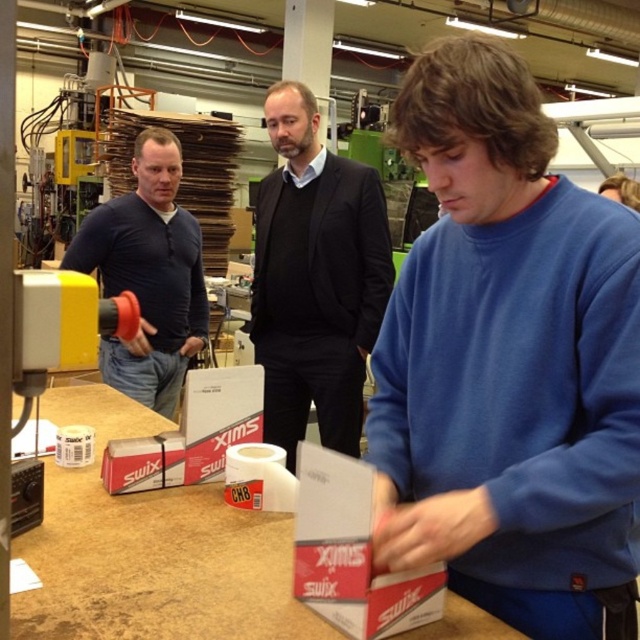
In the workshop scene, there are two people wearing the blue cotton sweatshirt at center and the matte black shirt at left. Which one is positioned to the right of the other?

The blue cotton sweatshirt at center is positioned to the right of the matte black shirt at left.

Based on the photo, you are a delivery person who needs to place a package between the black matte suit at center and the matte black shirt at left. Can you fit a 50 cm wide package between them?

The distance between the black matte suit at center and the matte black shirt at left is 52.04 centimeters, so yes, a 50 cm wide package can fit between them.